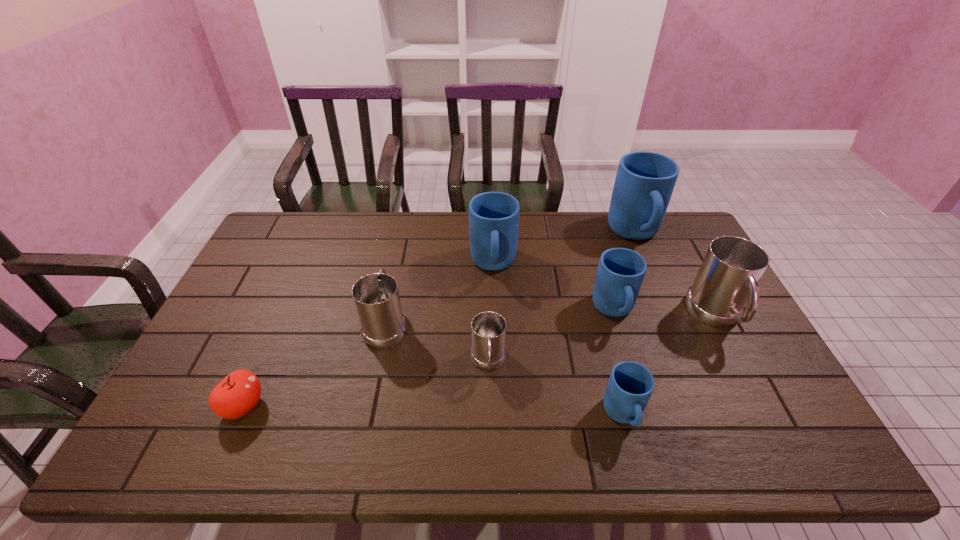
Find the location of a particular element. The width and height of the screenshot is (960, 540). the rightmost blue mug is located at coordinates (644, 183).

Identify the location of the biggest blue mug. (644, 183).

The height and width of the screenshot is (540, 960). Find the location of `the rightmost gray mug`. the rightmost gray mug is located at coordinates (728, 277).

Image resolution: width=960 pixels, height=540 pixels. In order to click on the third smallest blue mug in this screenshot , I will do `click(493, 216)`.

The image size is (960, 540). I want to click on the second object from left to right, so click(x=376, y=297).

At what (x,y) coordinates should I click in order to perform the action: click on the leftmost mug. Please return your answer as a coordinate pair (x, y). The width and height of the screenshot is (960, 540). Looking at the image, I should click on (376, 297).

This screenshot has height=540, width=960. In order to click on the third farthest blue mug in this screenshot , I will do `click(621, 271)`.

The width and height of the screenshot is (960, 540). I want to click on the second gray mug from right to left, so click(x=488, y=352).

You are a GUI agent. You are given a task and a screenshot of the screen. Output one action in this format:
    pyautogui.click(x=<x>, y=<y>)
    Task: Click on the nearest mug
    This screenshot has width=960, height=540.
    Given the screenshot: What is the action you would take?
    pyautogui.click(x=630, y=385)

In order to click on the smallest blue mug in this screenshot , I will do `click(630, 385)`.